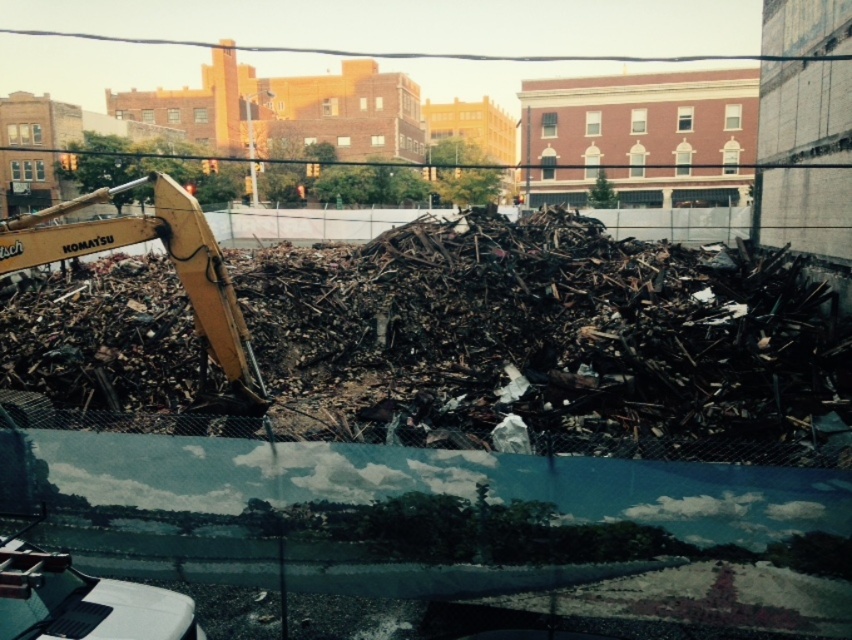
Does point (292, 305) lie behind point (128, 236)?

Yes, it is.

Can you confirm if dark metallic debris at center is positioned below yellow metallic excavator at left?

Correct, dark metallic debris at center is located below yellow metallic excavator at left.

The height and width of the screenshot is (640, 852). What do you see at coordinates (551, 340) in the screenshot? I see `dark metallic debris at center` at bounding box center [551, 340].

Where is `dark metallic debris at center`? The height and width of the screenshot is (640, 852). dark metallic debris at center is located at coordinates (551, 340).